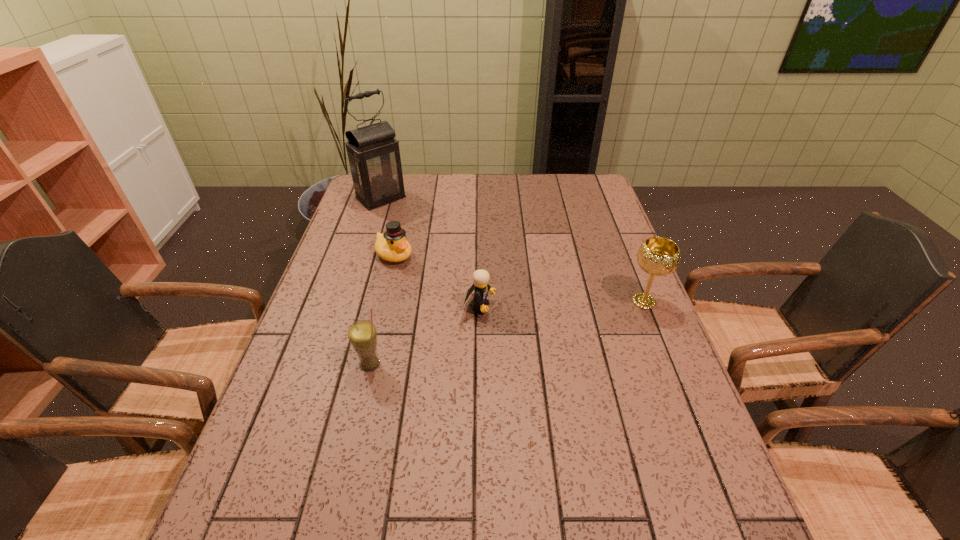
Find the location of `free spot on the desktop that is between the straw for drinking and the chalice and is positioned on the front-facing side of the duck`. free spot on the desktop that is between the straw for drinking and the chalice and is positioned on the front-facing side of the duck is located at coordinates (502, 334).

I want to click on vacant space on the desktop that is between the nearest object and the rightmost object and is positioned on the front-facing side of the fourth object from left to right, so click(556, 322).

What are the coordinates of `free space on the desktop that is between the nearest object and the chalice and is positioned on the front-facing side of the lantern` in the screenshot? It's located at (536, 326).